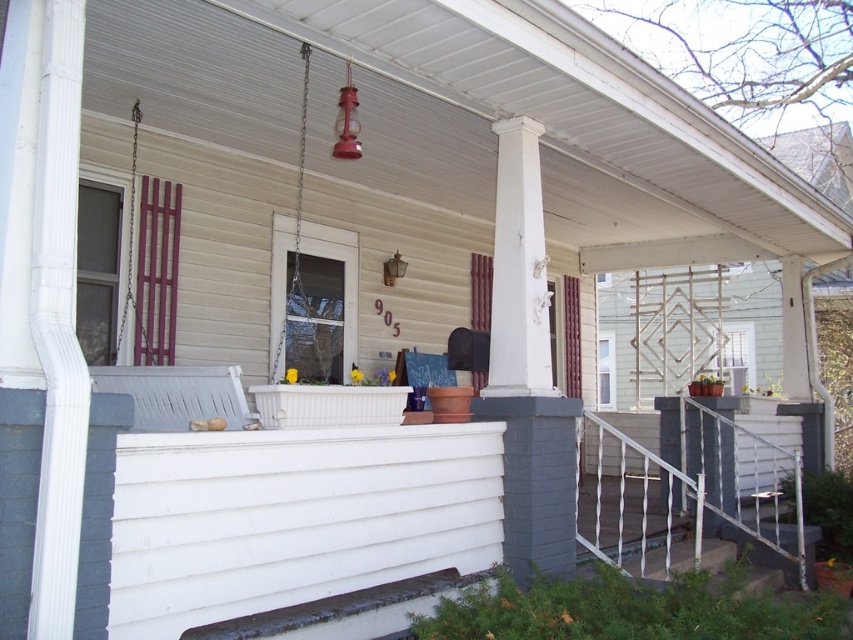
Question: Can you confirm if white metal railing at lower right is positioned to the left of metallic chain swing at center?

Choices:
 (A) no
 (B) yes

Answer: (A)

Question: Which of the following is the closest to the observer?

Choices:
 (A) metallic chain swing at center
 (B) white metal railing at lower right

Answer: (B)

Question: Is white metal railing at lower right to the right of metallic chain swing at center from the viewer's perspective?

Choices:
 (A) no
 (B) yes

Answer: (B)

Question: Observing the image, what is the correct spatial positioning of white metal railing at lower right in reference to metallic chain swing at center?

Choices:
 (A) right
 (B) left

Answer: (A)

Question: Which point is closer to the camera taking this photo?

Choices:
 (A) (636, 468)
 (B) (283, 314)

Answer: (B)